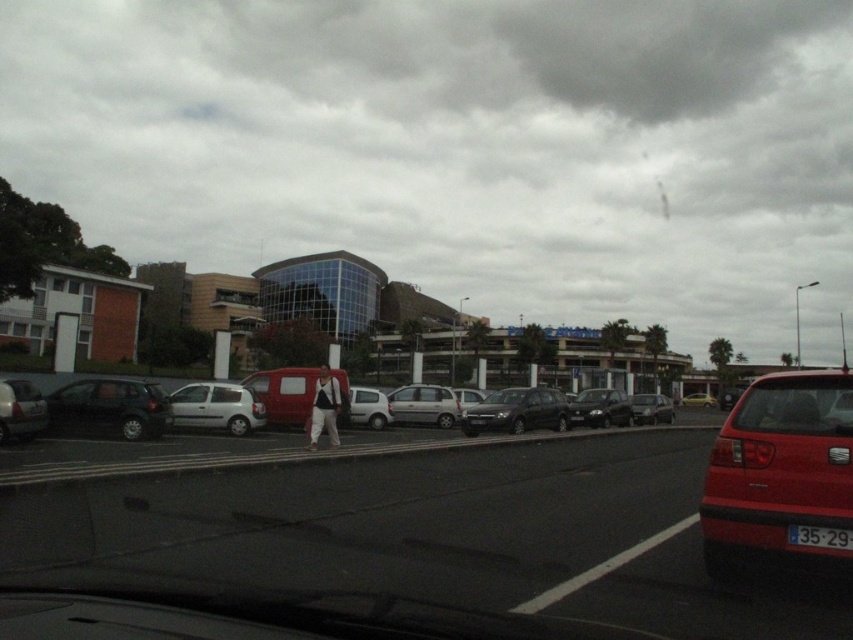
Question: Which of the following is the closest to the observer?

Choices:
 (A) black matte car at center
 (B) glossy red hatchback at lower right
 (C) silver metallic hatchback at center
 (D) satin silver van at center

Answer: (B)

Question: In this image, where is matte black suv at left located relative to satin silver van at center?

Choices:
 (A) right
 (B) left

Answer: (B)

Question: Does matte black suv at left appear under satin black sedan at center?

Choices:
 (A) no
 (B) yes

Answer: (A)

Question: Considering the relative positions of matte black car at center and white matte hatchback at center in the image provided, where is matte black car at center located with respect to white matte hatchback at center?

Choices:
 (A) above
 (B) below

Answer: (B)

Question: Which object is positioned closest to the silver metallic hatchback at center?

Choices:
 (A) shiny black sedan at center
 (B) satin silver van at center
 (C) white matte hatchback at center

Answer: (C)

Question: Which is farther from the white matte hatchback at center?

Choices:
 (A) black plastic license plate at center
 (B) satin black sedan at center
 (C) silver metallic hatchback at center

Answer: (A)